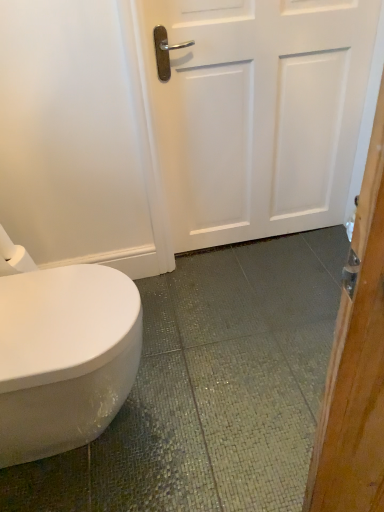
Question: Can you confirm if white matte door at center is shorter than white matte toilet paper at left?

Choices:
 (A) yes
 (B) no

Answer: (B)

Question: Is white matte door at center at the right side of white matte toilet paper at left?

Choices:
 (A) no
 (B) yes

Answer: (B)

Question: Is white matte door at center smaller than white matte toilet paper at left?

Choices:
 (A) yes
 (B) no

Answer: (B)

Question: Is white matte door at center taller than white matte toilet paper at left?

Choices:
 (A) yes
 (B) no

Answer: (A)

Question: Can you confirm if white matte door at center is thinner than white matte toilet paper at left?

Choices:
 (A) no
 (B) yes

Answer: (A)

Question: Does white matte door at center have a larger size compared to white matte toilet paper at left?

Choices:
 (A) no
 (B) yes

Answer: (B)

Question: Is white matte toilet paper at left at the left side of white matte door at center?

Choices:
 (A) yes
 (B) no

Answer: (A)

Question: From the image's perspective, is white matte toilet paper at left above white matte door at center?

Choices:
 (A) yes
 (B) no

Answer: (B)

Question: Is white matte door at center at the back of white matte toilet paper at left?

Choices:
 (A) no
 (B) yes

Answer: (A)

Question: Does white matte toilet paper at left have a lesser width compared to white matte door at center?

Choices:
 (A) no
 (B) yes

Answer: (B)

Question: Considering the relative positions of white matte toilet paper at left and white matte door at center in the image provided, is white matte toilet paper at left in front of white matte door at center?

Choices:
 (A) no
 (B) yes

Answer: (B)

Question: Is the position of white matte toilet paper at left more distant than that of white matte door at center?

Choices:
 (A) yes
 (B) no

Answer: (B)

Question: In terms of width, does white matte door at center look wider or thinner when compared to white matte toilet paper at left?

Choices:
 (A) thin
 (B) wide

Answer: (B)